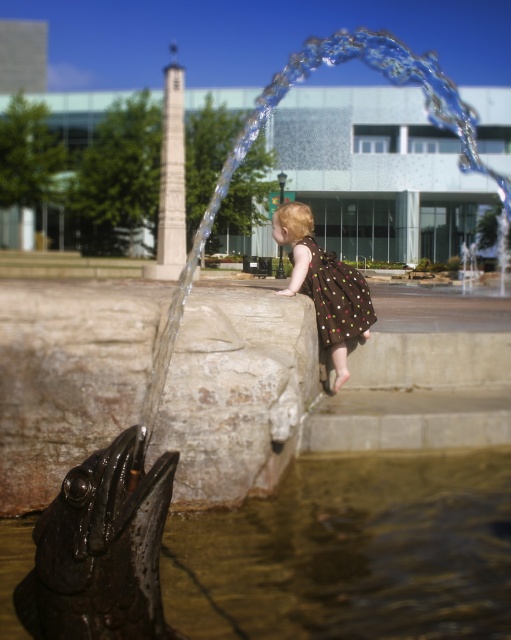
You are a photographer trying to capture the shiny metallic fish at lower left and the brown dotted dress at center in the same frame. Based on their positions, which object should you adjust your camera to focus on first to ensure both are in the frame?

The shiny metallic fish at lower left is to the right of the brown dotted dress at center, so you should focus on the brown dotted dress at center first to ensure both are in the frame.

You are standing in the outdoor fountain area and want to place a small decorative rock. You have two options for placement based on coordinates given in the image. The first option is at point (x=482, y=588), and the second option is at point (x=358, y=273). Which point is closer to you where you are standing?

Point (x=482, y=588) is closer to the viewer than point (x=358, y=273), so the first option is closer.

You are a fashion designer observing the scene and want to create a new dress design. Which dress, the brown dotted dress at center or the brown dotted fabric dress at upper center, should you base your design on if you want a wider silhouette?

The brown dotted dress at center has a larger width than the brown dotted fabric dress at upper center, so you should base your design on the brown dotted dress at center to achieve a wider silhouette.